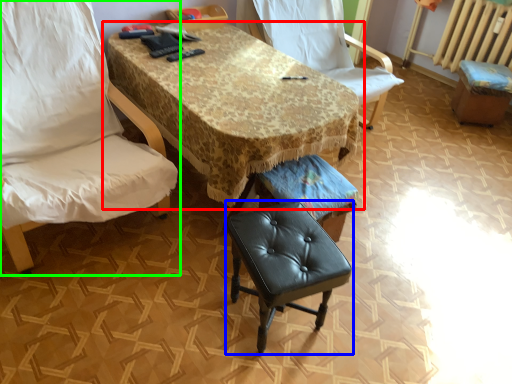
Question: Estimate the real-world distances between objects in this image. Which object is farther from table (highlighted by a red box), stool (highlighted by a blue box) or chair (highlighted by a green box)?

Choices:
 (A) stool
 (B) chair

Answer: (A)